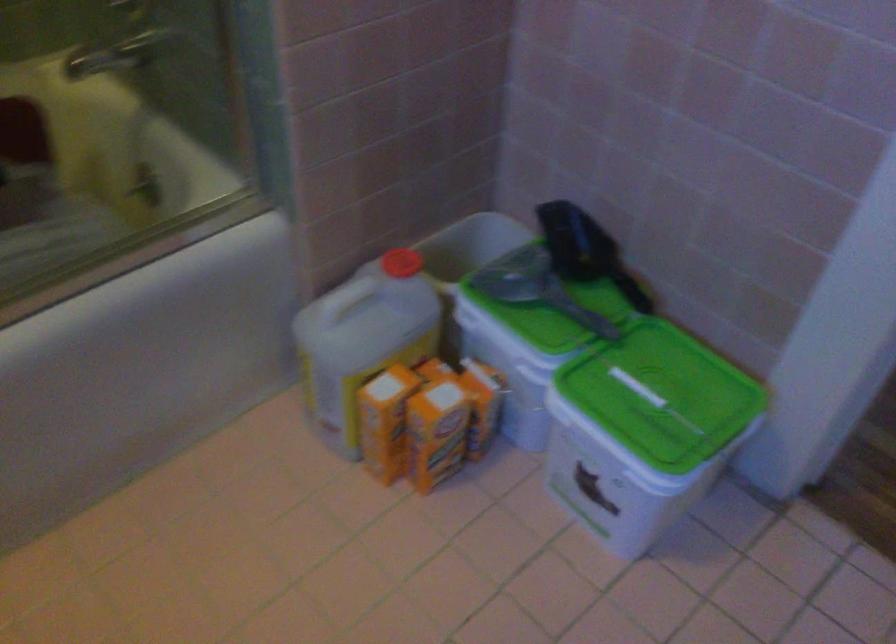
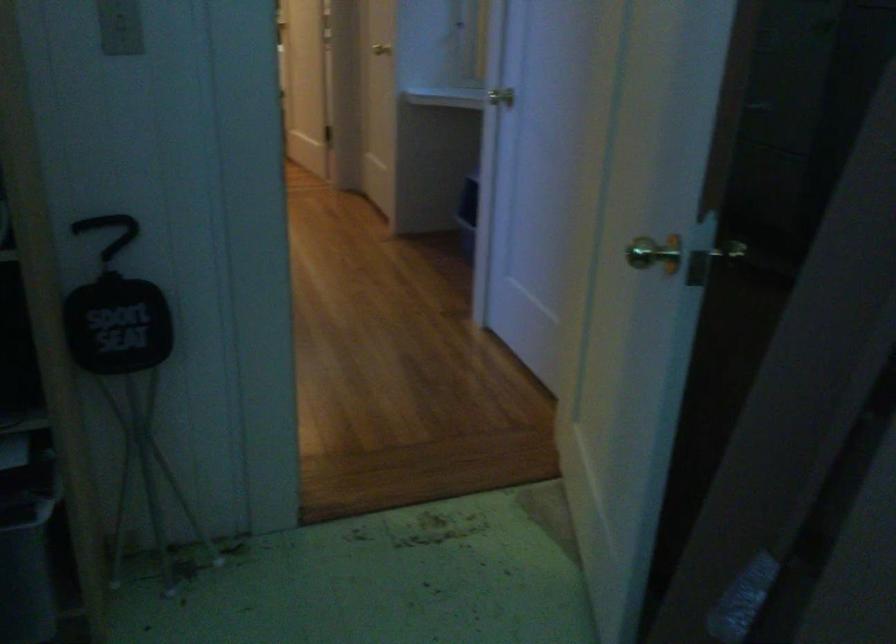
The images are taken continuously from a first-person perspective. In which direction are you moving?

The cameraman moved toward right, backward.